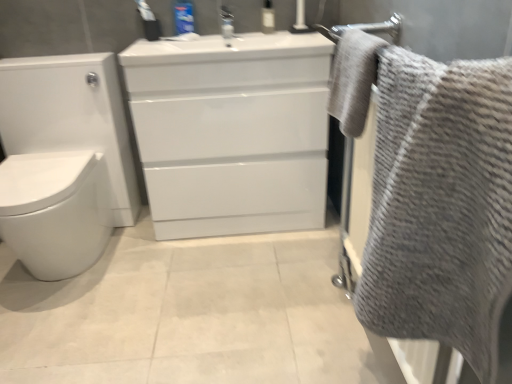
What do you see at coordinates (353, 79) in the screenshot?
I see `gray textured towel at upper right, acting as the first bath towel starting from the top` at bounding box center [353, 79].

Locate an element on the screen. The width and height of the screenshot is (512, 384). blue plastic toothpaste tube at upper center, placed as the second toiletry when sorted from right to left is located at coordinates (183, 16).

From a real-world perspective, does white glossy toilet at left stand above blue plastic toothpaste tube at upper center, which is counted as the 1th toiletry, starting from the left?

No.

Who is shorter, white glossy toilet at left or blue plastic toothpaste tube at upper center, placed as the second toiletry when sorted from right to left?

With less height is blue plastic toothpaste tube at upper center, placed as the second toiletry when sorted from right to left.

Which of these two, white glossy toilet at left or blue plastic toothpaste tube at upper center, which is counted as the 1th toiletry, starting from the left, is thinner?

With smaller width is blue plastic toothpaste tube at upper center, which is counted as the 1th toiletry, starting from the left.

Is white glossy toilet at left spatially inside blue plastic toothpaste tube at upper center, placed as the second toiletry when sorted from right to left, or outside of it?

white glossy toilet at left lies outside blue plastic toothpaste tube at upper center, placed as the second toiletry when sorted from right to left.

Is transparent plastic bottle at upper center, the second toiletry positioned from the left, closer to camera compared to blue plastic toothpaste tube at upper center, placed as the second toiletry when sorted from right to left?

No, transparent plastic bottle at upper center, the second toiletry positioned from the left, is behind blue plastic toothpaste tube at upper center, placed as the second toiletry when sorted from right to left.

How much distance is there between transparent plastic bottle at upper center, the second toiletry positioned from the left, and blue plastic toothpaste tube at upper center, which is counted as the 1th toiletry, starting from the left?

transparent plastic bottle at upper center, the second toiletry positioned from the left, and blue plastic toothpaste tube at upper center, which is counted as the 1th toiletry, starting from the left, are 13.60 inches apart.

Is transparent plastic bottle at upper center, the second toiletry positioned from the left, bigger or smaller than blue plastic toothpaste tube at upper center, placed as the second toiletry when sorted from right to left?

In the image, transparent plastic bottle at upper center, the second toiletry positioned from the left, appears to be smaller than blue plastic toothpaste tube at upper center, placed as the second toiletry when sorted from right to left.

Would you say transparent plastic bottle at upper center, the second toiletry positioned from the left, is inside or outside blue plastic toothpaste tube at upper center, placed as the second toiletry when sorted from right to left?

transparent plastic bottle at upper center, the second toiletry positioned from the left, is located beyond the bounds of blue plastic toothpaste tube at upper center, placed as the second toiletry when sorted from right to left.

Is gray textured towel at right, the 2th bath towel positioned from the top, not near gray textured towel at upper right, which is the 2th bath towel from bottom to top?

No.

Is gray textured towel at right, the 2th bath towel positioned from the top, bigger than gray textured towel at upper right, which is the 2th bath towel from bottom to top?

Indeed, gray textured towel at right, the 2th bath towel positioned from the top, has a larger size compared to gray textured towel at upper right, which is the 2th bath towel from bottom to top.

Is gray textured towel at right, the 2th bath towel positioned from the top, taller or shorter than gray textured towel at upper right, which is the 2th bath towel from bottom to top?

In the image, gray textured towel at right, the 2th bath towel positioned from the top, appears to be taller than gray textured towel at upper right, which is the 2th bath towel from bottom to top.

From the image's perspective, is white glossy cabinet at center located above or below white glossy toilet at left?

white glossy cabinet at center is above white glossy toilet at left.

Based on their sizes in the image, would you say white glossy cabinet at center is bigger or smaller than white glossy toilet at left?

In the image, white glossy cabinet at center appears to be smaller than white glossy toilet at left.

Is white glossy cabinet at center oriented away from white glossy toilet at left?

No, white glossy cabinet at center's orientation is not away from white glossy toilet at left.

Is white glossy cabinet at center taller than white glossy toilet at left?

Correct, white glossy cabinet at center is much taller as white glossy toilet at left.

In terms of width, does white glossy cabinet at center look wider or thinner when compared to gray textured towel at upper right, which is the 2th bath towel from bottom to top?

Clearly, white glossy cabinet at center has more width compared to gray textured towel at upper right, which is the 2th bath towel from bottom to top.

Between white glossy cabinet at center and gray textured towel at upper right, acting as the first bath towel starting from the top, which one appears on the left side from the viewer's perspective?

Positioned to the left is white glossy cabinet at center.

Is transparent plastic bottle at upper center, which ranks as the first toiletry in right-to-left order, inside or outside of gray textured towel at upper right, acting as the first bath towel starting from the top?

transparent plastic bottle at upper center, which ranks as the first toiletry in right-to-left order, is located beyond the bounds of gray textured towel at upper right, acting as the first bath towel starting from the top.

From the image's perspective, is transparent plastic bottle at upper center, the second toiletry positioned from the left, above gray textured towel at upper right, which is the 2th bath towel from bottom to top?

Indeed, from the image's perspective, transparent plastic bottle at upper center, the second toiletry positioned from the left, is shown above gray textured towel at upper right, which is the 2th bath towel from bottom to top.

Is white glossy cabinet at center located outside blue plastic toothpaste tube at upper center, placed as the second toiletry when sorted from right to left?

Yes.

How different are the orientations of white glossy cabinet at center and blue plastic toothpaste tube at upper center, which is counted as the 1th toiletry, starting from the left, in degrees?

0.805 degrees.

Starting from the white glossy cabinet at center, which toiletry is the 1st one behind? Please provide its 2D coordinates.

[(183, 16)]

Is white glossy cabinet at center at the right side of blue plastic toothpaste tube at upper center, placed as the second toiletry when sorted from right to left?

Correct, you'll find white glossy cabinet at center to the right of blue plastic toothpaste tube at upper center, placed as the second toiletry when sorted from right to left.

Locate an element on the screen. This screenshot has height=384, width=512. toilet on the left of blue plastic toothpaste tube at upper center, which is counted as the 1th toiletry, starting from the left is located at coordinates (71, 116).

Where is `toiletry located behind the blue plastic toothpaste tube at upper center, which is counted as the 1th toiletry, starting from the left`? The height and width of the screenshot is (384, 512). toiletry located behind the blue plastic toothpaste tube at upper center, which is counted as the 1th toiletry, starting from the left is located at coordinates (268, 17).

Looking at the image, which one is located further to transparent plastic bottle at upper center, which ranks as the first toiletry in right-to-left order, blue plastic toothpaste tube at upper center, which is counted as the 1th toiletry, starting from the left, or white glossy cabinet at center?

Based on the image, white glossy cabinet at center appears to be further to transparent plastic bottle at upper center, which ranks as the first toiletry in right-to-left order.

Considering their positions, is gray textured towel at upper right, which is the 2th bath towel from bottom to top, positioned closer to gray textured towel at right, the 2th bath towel positioned from the top, than blue plastic toothpaste tube at upper center, placed as the second toiletry when sorted from right to left?

gray textured towel at upper right, which is the 2th bath towel from bottom to top.

From the image, which object appears to be farther from white glossy cabinet at center, blue plastic toothpaste tube at upper center, which is counted as the 1th toiletry, starting from the left, or gray textured towel at right, the 2th bath towel positioned from the top?

Among the two, gray textured towel at right, the 2th bath towel positioned from the top, is located further to white glossy cabinet at center.

Which object lies further to the anchor point transparent plastic bottle at upper center, which ranks as the first toiletry in right-to-left order, gray textured towel at right, the 2th bath towel positioned from the top, or white glossy toilet at left?

gray textured towel at right, the 2th bath towel positioned from the top.

Considering their positions, is transparent plastic bottle at upper center, the second toiletry positioned from the left, positioned further to gray textured towel at right, the 1th bath towel ordered from the bottom, than white glossy cabinet at center?

transparent plastic bottle at upper center, the second toiletry positioned from the left.

When comparing their distances from white glossy toilet at left, does white glossy cabinet at center or gray textured towel at right, the 1th bath towel ordered from the bottom, seem closer?

white glossy cabinet at center is closer to white glossy toilet at left.

Based on their spatial positions, is gray textured towel at upper right, acting as the first bath towel starting from the top, or gray textured towel at right, the 2th bath towel positioned from the top, closer to white glossy cabinet at center?

Based on the image, gray textured towel at upper right, acting as the first bath towel starting from the top, appears to be nearer to white glossy cabinet at center.

From the image, which object appears to be farther from transparent plastic bottle at upper center, which ranks as the first toiletry in right-to-left order, white glossy toilet at left or gray textured towel at upper right, acting as the first bath towel starting from the top?

white glossy toilet at left is positioned further to the anchor transparent plastic bottle at upper center, which ranks as the first toiletry in right-to-left order.

Where is `bathroom cabinet located between gray textured towel at right, the 1th bath towel ordered from the bottom, and transparent plastic bottle at upper center, which ranks as the first toiletry in right-to-left order, in the depth direction`? bathroom cabinet located between gray textured towel at right, the 1th bath towel ordered from the bottom, and transparent plastic bottle at upper center, which ranks as the first toiletry in right-to-left order, in the depth direction is located at coordinates (232, 133).

At what (x,y) coordinates should I click in order to perform the action: click on toilet between gray textured towel at right, the 2th bath towel positioned from the top, and blue plastic toothpaste tube at upper center, which is counted as the 1th toiletry, starting from the left, along the z-axis. Please return your answer as a coordinate pair (x, y). This screenshot has width=512, height=384. Looking at the image, I should click on (71, 116).

The image size is (512, 384). What are the coordinates of `toilet between gray textured towel at right, the 1th bath towel ordered from the bottom, and transparent plastic bottle at upper center, which ranks as the first toiletry in right-to-left order, in the front-back direction` in the screenshot? It's located at (71, 116).

At what (x,y) coordinates should I click in order to perform the action: click on toiletry between gray textured towel at right, the 2th bath towel positioned from the top, and transparent plastic bottle at upper center, which ranks as the first toiletry in right-to-left order, along the z-axis. Please return your answer as a coordinate pair (x, y). This screenshot has height=384, width=512. Looking at the image, I should click on (183, 16).